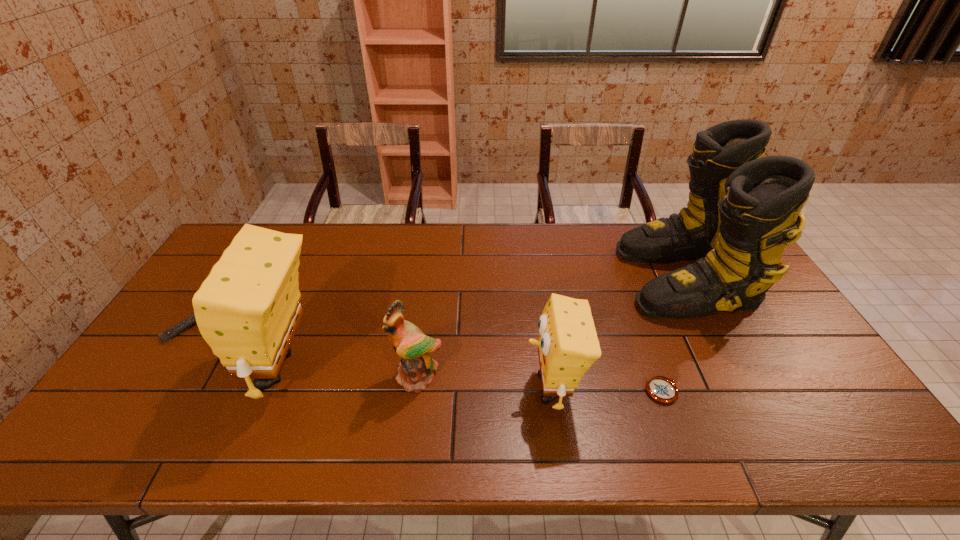
Locate an element on the screen. This screenshot has height=540, width=960. free point located on the face of the second tallest object is located at coordinates (200, 368).

Find the location of a particular element. The height and width of the screenshot is (540, 960). vacant space located on the face of the shorter sponge is located at coordinates (472, 388).

The width and height of the screenshot is (960, 540). What are the coordinates of `free space located 0.290m on the face of the shorter sponge` in the screenshot? It's located at (410, 388).

This screenshot has width=960, height=540. What are the coordinates of `vacant region located on the face of the shorter sponge` in the screenshot? It's located at (429, 388).

Identify the location of free space located on the back of the leftmost object. (224, 272).

In order to click on free space located on the left of the ski boots in this screenshot , I will do `click(565, 279)`.

Find the location of a particular element. vacant space located on the right of the compass is located at coordinates (766, 391).

At what (x,y) coordinates should I click in order to perform the action: click on object that is at the far edge. Please return your answer as a coordinate pair (x, y). Looking at the image, I should click on (743, 208).

The image size is (960, 540). I want to click on parrot that is at the near edge, so click(415, 370).

You are a GUI agent. You are given a task and a screenshot of the screen. Output one action in this format:
    pyautogui.click(x=<x>, y=<y>)
    Task: Click on the compass at the near edge
    The height and width of the screenshot is (540, 960).
    Given the screenshot: What is the action you would take?
    pyautogui.click(x=661, y=389)